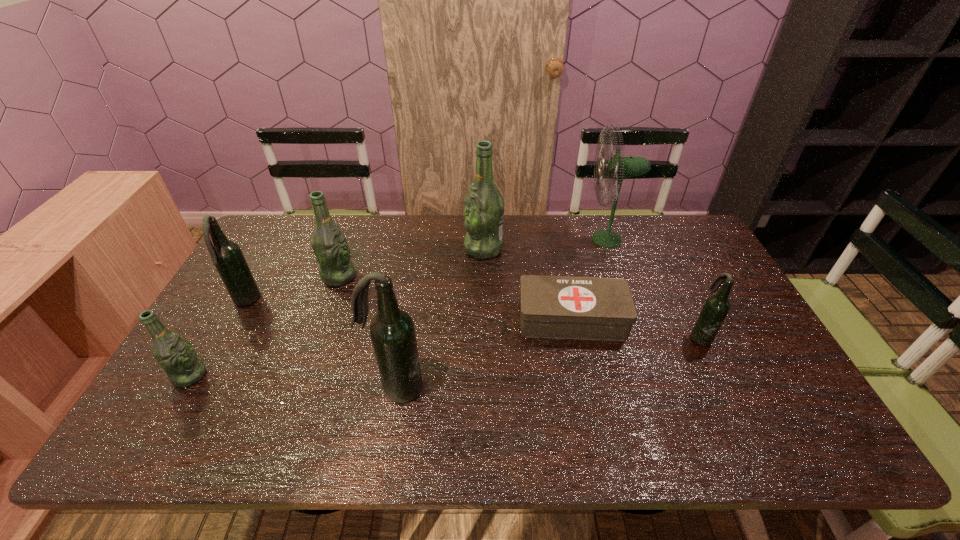
Identify the location of green fan. (618, 167).

Find the location of `the farthest beer bottle`. the farthest beer bottle is located at coordinates (484, 206).

Identify the location of the farthest green beer bottle. The image size is (960, 540). (484, 206).

This screenshot has height=540, width=960. In order to click on the second dark beer bottle from left to right in this screenshot , I will do `click(392, 331)`.

Image resolution: width=960 pixels, height=540 pixels. In order to click on the third beer bottle from right to left in this screenshot , I will do `click(392, 331)`.

This screenshot has height=540, width=960. Find the location of `the second smallest green beer bottle`. the second smallest green beer bottle is located at coordinates (330, 247).

Where is `the second farthest green beer bottle`? Image resolution: width=960 pixels, height=540 pixels. the second farthest green beer bottle is located at coordinates (330, 247).

What are the coordinates of `the farthest dark beer bottle` in the screenshot? It's located at (226, 255).

The height and width of the screenshot is (540, 960). I want to click on the leftmost dark beer bottle, so click(x=226, y=255).

Identify the location of the rightmost object. This screenshot has height=540, width=960. (716, 307).